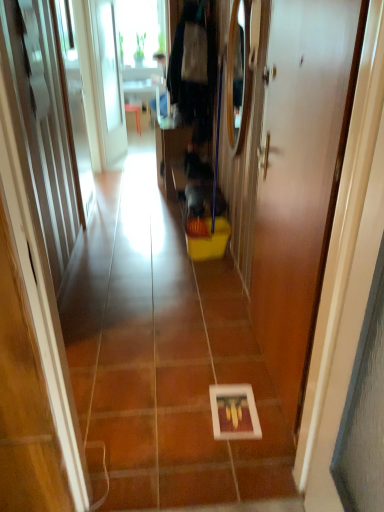
Question: Can you confirm if white glossy door at center is wider than white glossy picture frame at center?

Choices:
 (A) no
 (B) yes

Answer: (A)

Question: Is white glossy door at center taller than white glossy picture frame at center?

Choices:
 (A) no
 (B) yes

Answer: (B)

Question: Is white glossy door at center closer to the viewer compared to white glossy picture frame at center?

Choices:
 (A) no
 (B) yes

Answer: (B)

Question: Is white glossy door at center bigger than white glossy picture frame at center?

Choices:
 (A) no
 (B) yes

Answer: (A)

Question: From the image's perspective, is white glossy door at center on white glossy picture frame at center?

Choices:
 (A) no
 (B) yes

Answer: (A)

Question: Is white glossy door at center next to white glossy picture frame at center and touching it?

Choices:
 (A) no
 (B) yes

Answer: (A)

Question: Can you confirm if white glossy picture frame at center is taller than white glossy door at center?

Choices:
 (A) no
 (B) yes

Answer: (A)

Question: Are white glossy picture frame at center and white glossy door at center located far from each other?

Choices:
 (A) yes
 (B) no

Answer: (B)

Question: Can you confirm if white glossy picture frame at center is shorter than white glossy door at center?

Choices:
 (A) no
 (B) yes

Answer: (B)

Question: Can you confirm if white glossy picture frame at center is bigger than white glossy door at center?

Choices:
 (A) no
 (B) yes

Answer: (B)

Question: From a real-world perspective, is white glossy picture frame at center beneath white glossy door at center?

Choices:
 (A) no
 (B) yes

Answer: (B)

Question: Is white glossy picture frame at center directly adjacent to white glossy door at center?

Choices:
 (A) no
 (B) yes

Answer: (A)

Question: In terms of size, does white glossy picture frame at center appear bigger or smaller than white glossy door at center?

Choices:
 (A) big
 (B) small

Answer: (A)